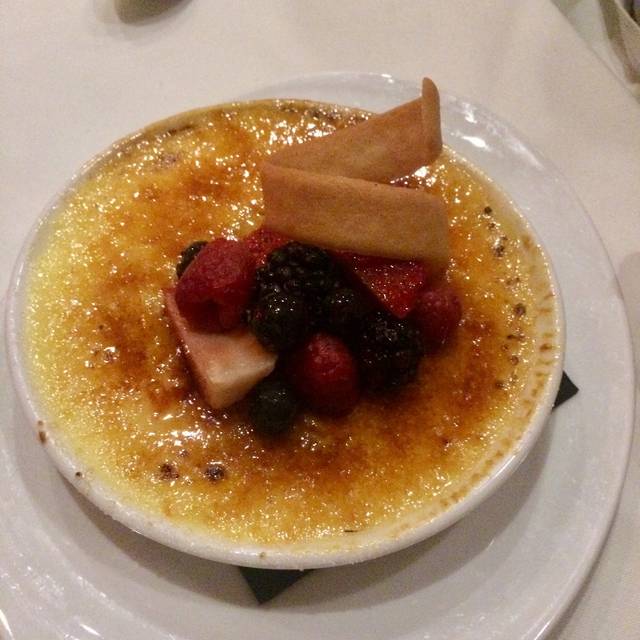
I want to click on table, so click(82, 68).